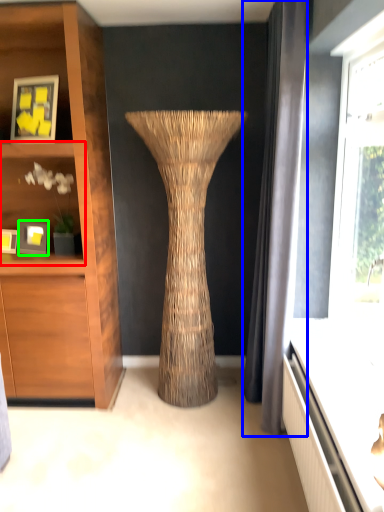
Question: Which is nearer to the shelf (highlighted by a red box)? curtain (highlighted by a blue box) or picture frame (highlighted by a green box).

Choices:
 (A) curtain
 (B) picture frame

Answer: (B)